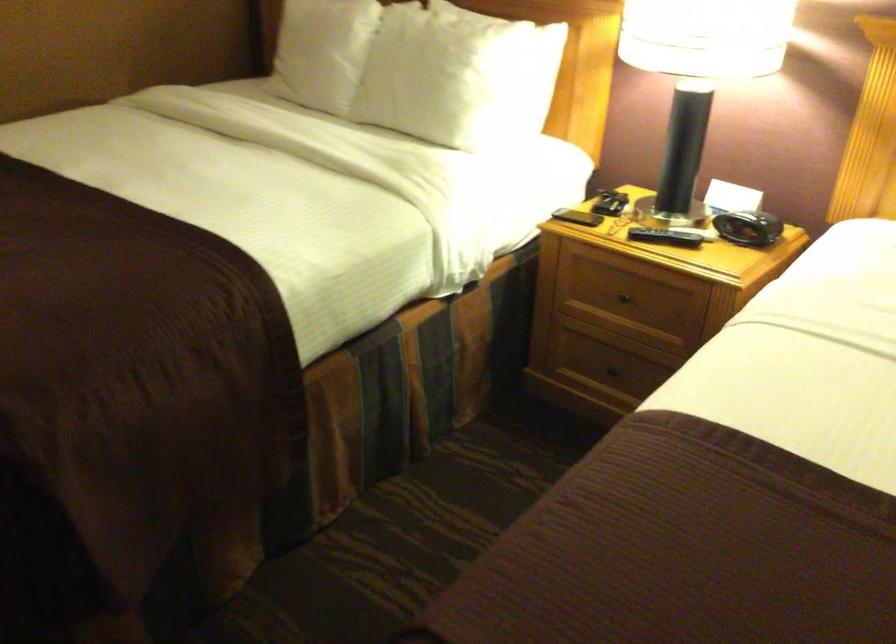
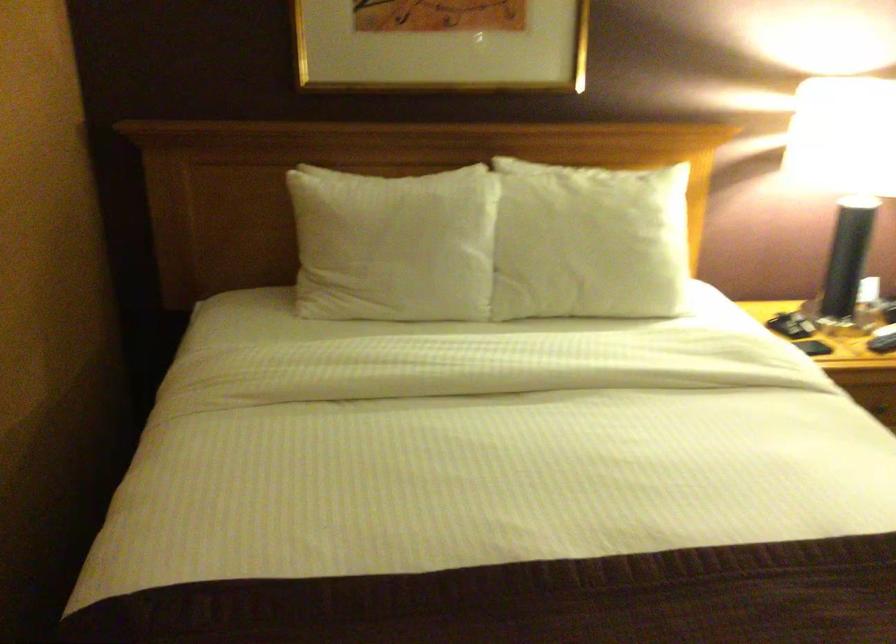
Where in the second image is the point corresponding to (x=600, y=200) from the first image?

(782, 325)